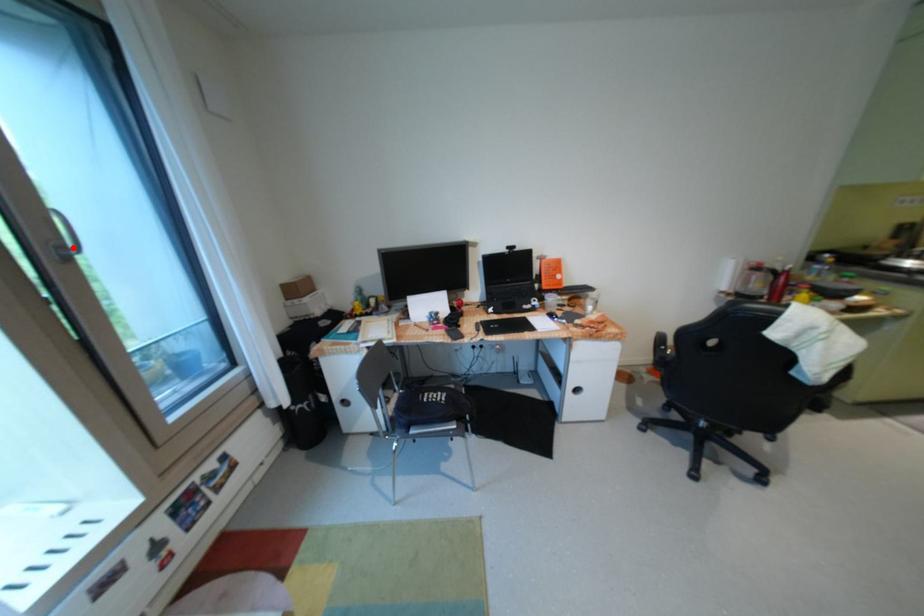
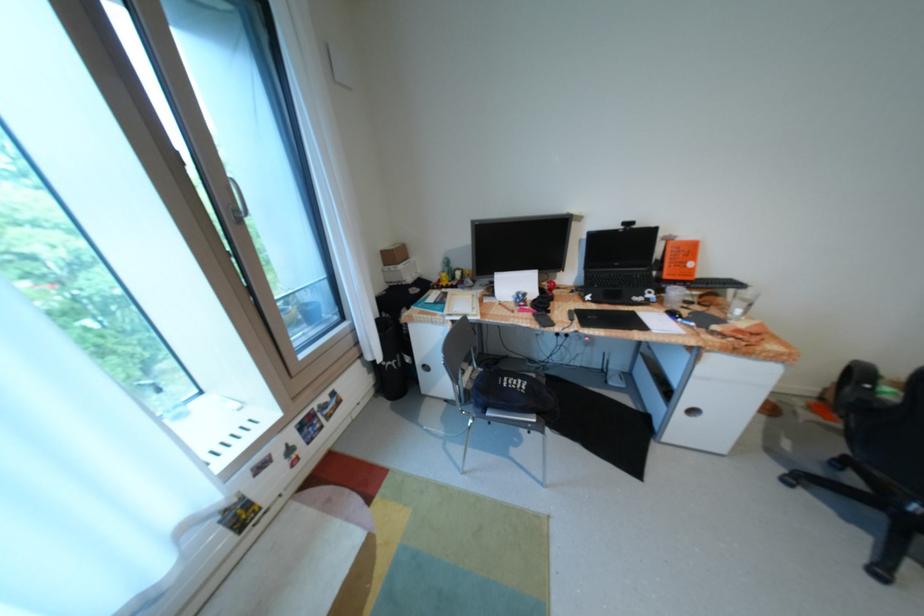
Question: I am providing you with two images of the same scene from different viewpoints. Image1 has a red point marked. In image2, the corresponding 3D location appears at what relative position? Reply with the corresponding letter.

Choices:
 (A) Closer
 (B) Farther

Answer: (A)